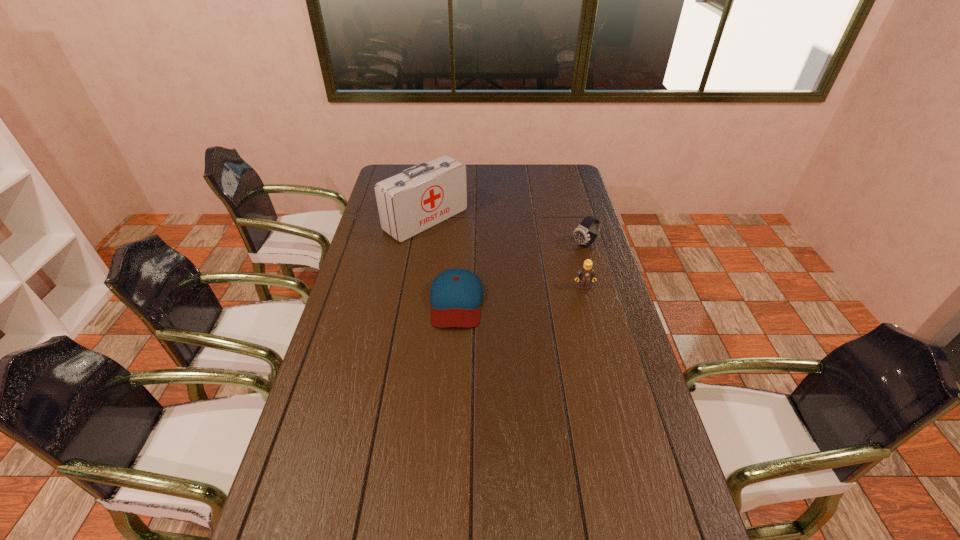
What are the coordinates of `free space located 0.220m on the face of the watch` in the screenshot? It's located at (537, 276).

Locate an element on the screen. The width and height of the screenshot is (960, 540). vacant space located on the face of the watch is located at coordinates (516, 290).

I want to click on object that is at the left edge, so click(420, 197).

The width and height of the screenshot is (960, 540). Find the location of `Lego that is at the right edge`. Lego that is at the right edge is located at coordinates (585, 274).

Locate an element on the screen. The image size is (960, 540). watch present at the right edge is located at coordinates (581, 235).

This screenshot has height=540, width=960. I want to click on vacant space at the far edge of the desktop, so [x=485, y=187].

Where is `free region at the left edge of the desktop`? free region at the left edge of the desktop is located at coordinates (311, 422).

Identify the location of vacant space at the right edge of the desktop. The image size is (960, 540). (561, 215).

Identify the location of vacant space at the far left corner of the desktop. (401, 169).

I want to click on free space at the near left corner of the desktop, so click(335, 525).